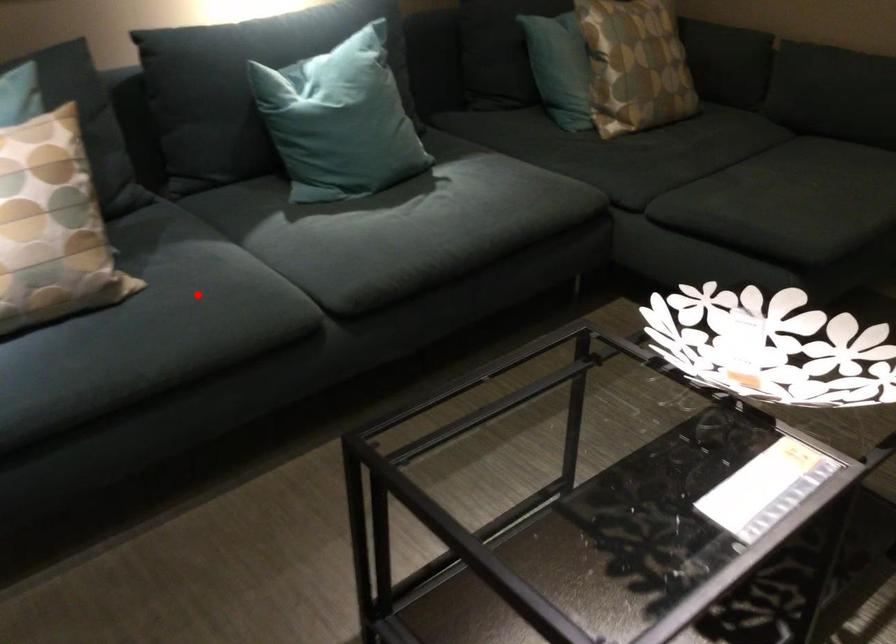
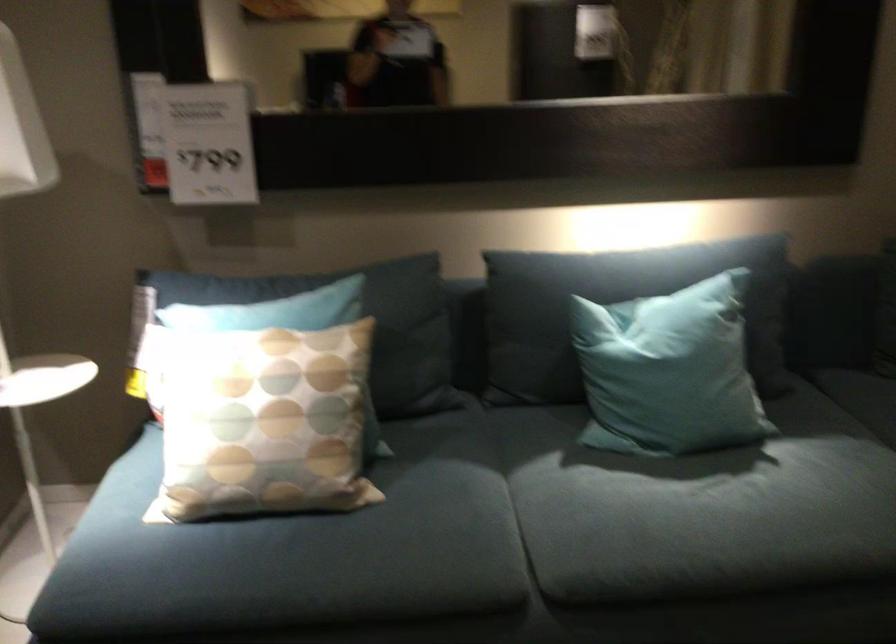
In the second image, find the point that corresponds to the highlighted location in the first image.

(406, 526)